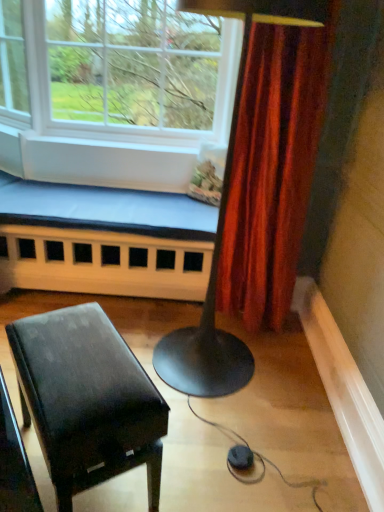
Locate an element on the screen. The width and height of the screenshot is (384, 512). free point above white wood church bench at lower left (from a real-world perspective) is located at coordinates (124, 201).